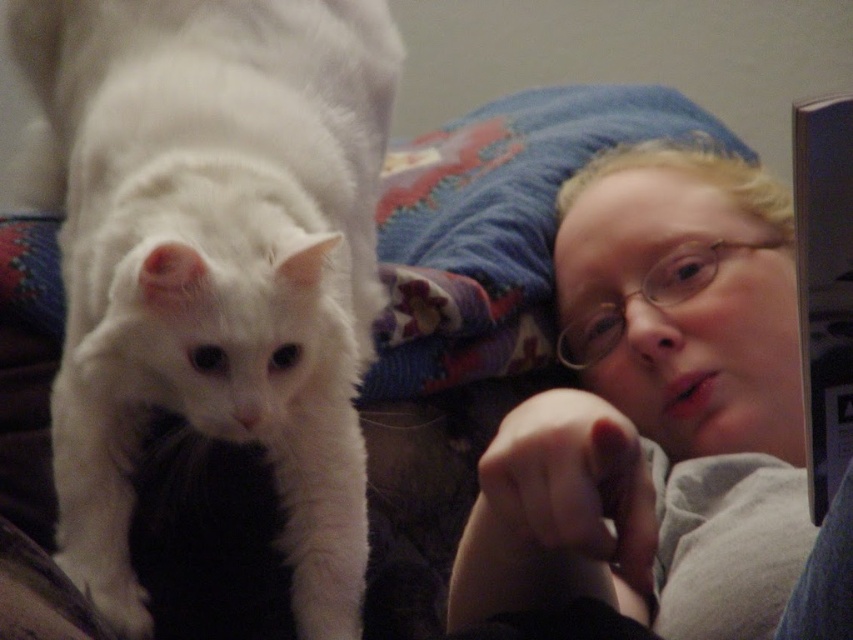
Question: Which object is positioned farthest from the smooth gray shirt at upper right?

Choices:
 (A) white fluffy paw at lower left
 (B) white fluffy cat at left

Answer: (B)

Question: Considering the real-world distances, which object is farthest from the smooth gray shirt at upper right?

Choices:
 (A) white fluffy paw at lower left
 (B) white fluffy cat at left

Answer: (B)

Question: Where is white fluffy cat at left located in relation to white fluffy paw at lower left in the image?

Choices:
 (A) above
 (B) below

Answer: (A)

Question: Which object is closer to the camera taking this photo?

Choices:
 (A) white fluffy paw at lower left
 (B) smooth gray shirt at upper right
 (C) white fluffy cat at left

Answer: (A)

Question: Does white fluffy cat at left come behind white fluffy paw at lower left?

Choices:
 (A) no
 (B) yes

Answer: (B)

Question: Is white fluffy cat at left wider than smooth gray shirt at upper right?

Choices:
 (A) no
 (B) yes

Answer: (B)